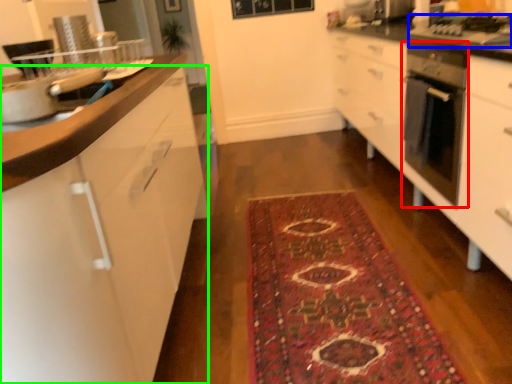
Question: Which object is the closest to the home appliance (highlighted by a red box)? Choose among these: gas stove (highlighted by a blue box) or cabinetry (highlighted by a green box).

Choices:
 (A) gas stove
 (B) cabinetry

Answer: (A)